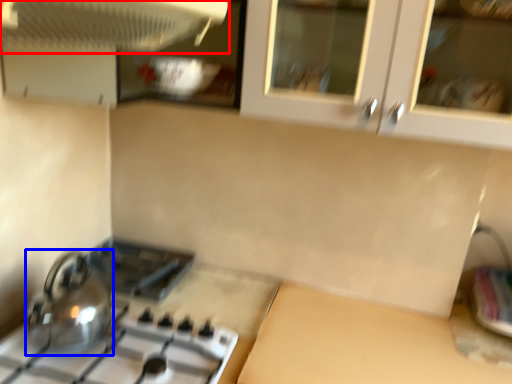
Question: Which object is further to the camera taking this photo, kitchen appliance (highlighted by a red box) or kitchen appliance (highlighted by a blue box)?

Choices:
 (A) kitchen appliance
 (B) kitchen appliance

Answer: (B)